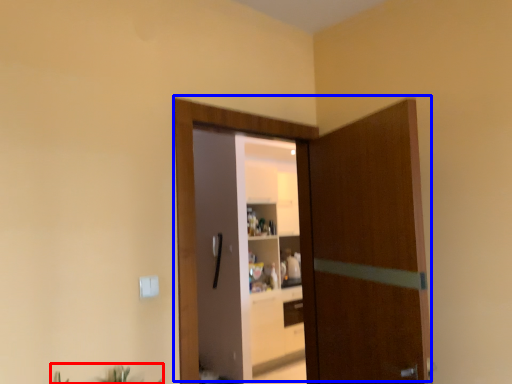
Question: Which of the following is the closest to the observer, plant (highlighted by a red box) or door (highlighted by a blue box)?

Choices:
 (A) plant
 (B) door

Answer: (A)